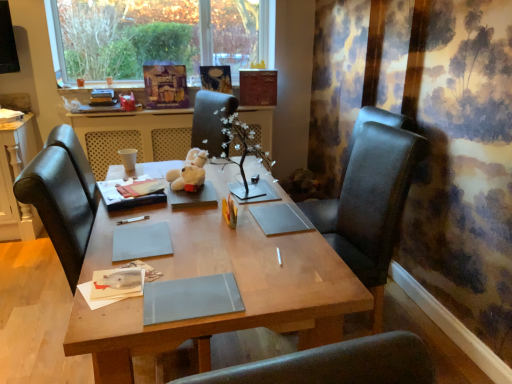
You are a GUI agent. You are given a task and a screenshot of the screen. Output one action in this format:
    pyautogui.click(x=<x>, y=<y>)
    Task: Click on the vacant region above matte paper book at center (from a real-world perspective)
    Image resolution: width=512 pixels, height=384 pixels.
    Given the screenshot: What is the action you would take?
    140,180